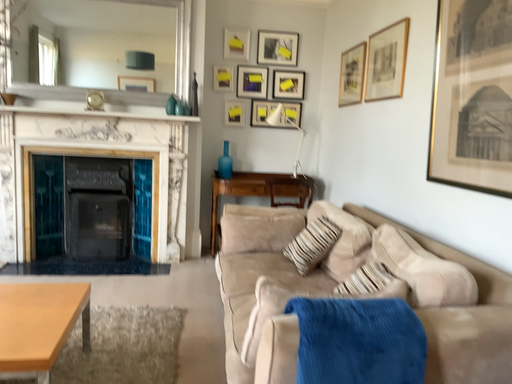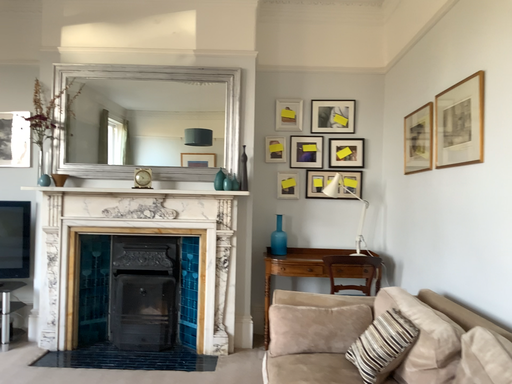
Question: How did the camera likely rotate when shooting the video?

Choices:
 (A) rotated upward
 (B) rotated downward

Answer: (A)